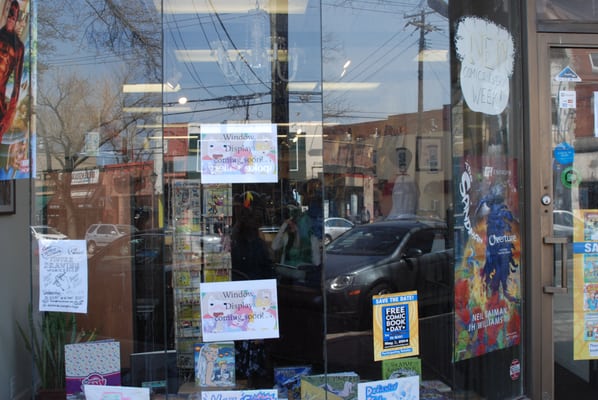
You are a GUI agent. You are given a task and a screenshot of the screen. Output one action in this format:
    pyautogui.click(x=<x>, y=<y>)
    Task: Click on the large poster
    The image size is (598, 400).
    Given the screenshot: What is the action you would take?
    pyautogui.click(x=16, y=137), pyautogui.click(x=475, y=225), pyautogui.click(x=597, y=277)